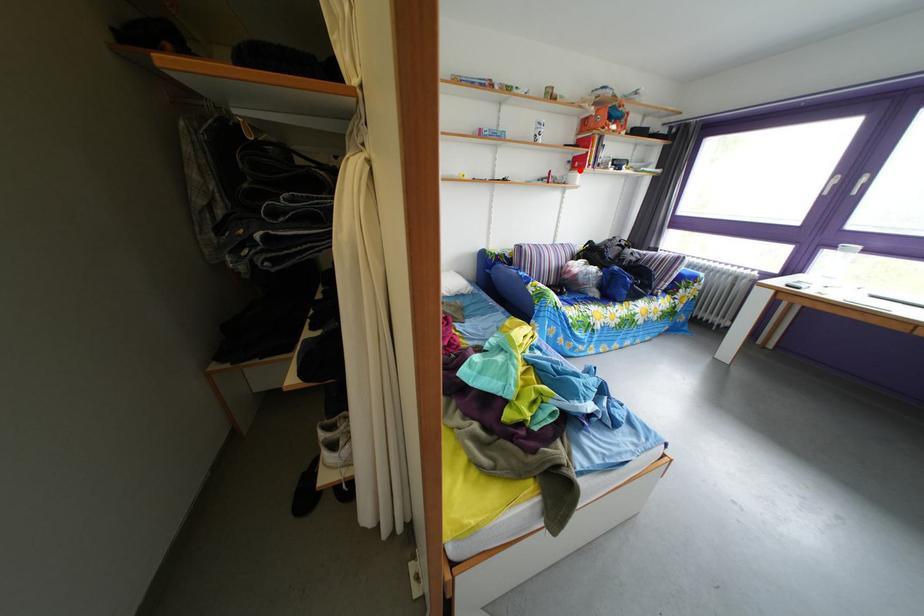
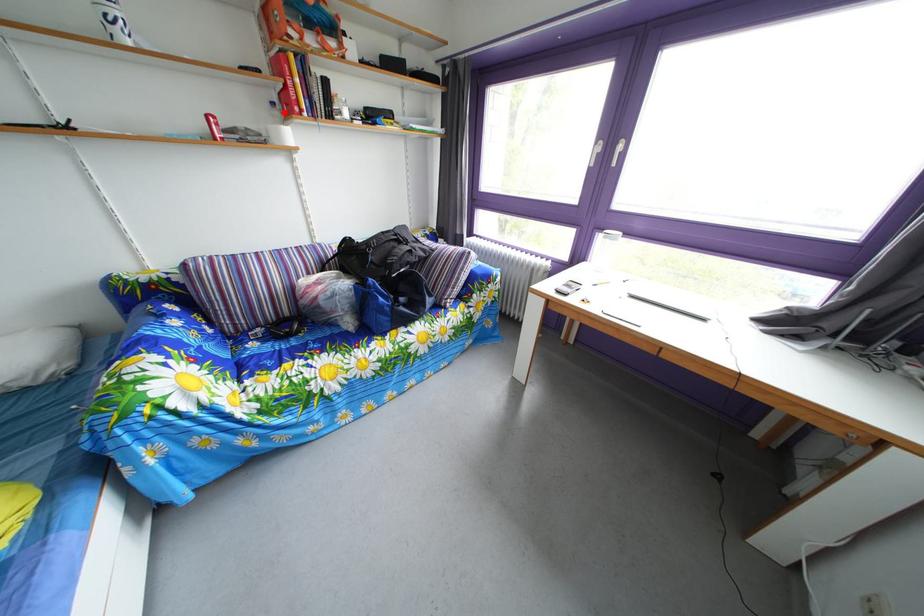
I am providing you with two images of the same scene from different viewpoints. A red point is marked on the first image and another point is marked on the second image. Is the marked point in image1 the same physical position as the marked point in image2?

Yes